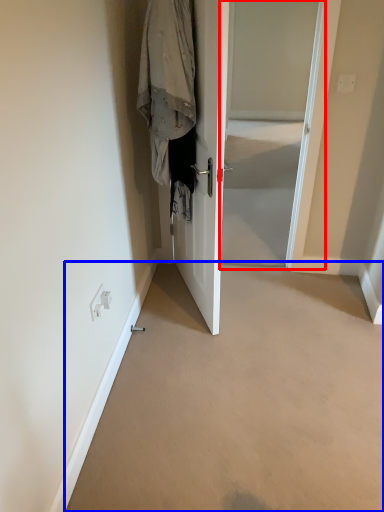
Question: Which object appears farthest to the camera in this image, screen door (highlighted by a red box) or corridor (highlighted by a blue box)?

Choices:
 (A) screen door
 (B) corridor

Answer: (A)